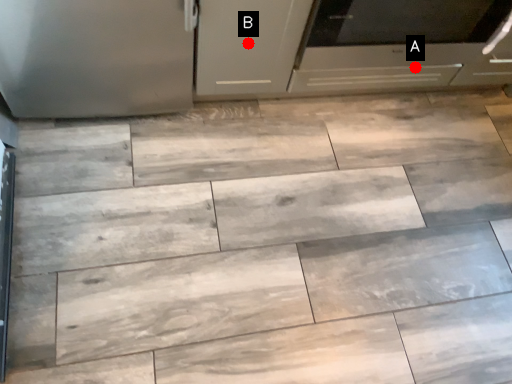
Question: Two points are circled on the image, labeled by A and B beside each circle. Which of the following is the closest to the observer?

Choices:
 (A) A is closer
 (B) B is closer

Answer: (B)